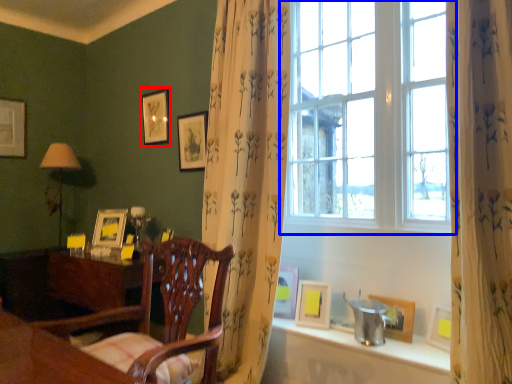
Question: Among these objects, which one is farthest to the camera, picture frame (highlighted by a red box) or window (highlighted by a blue box)?

Choices:
 (A) picture frame
 (B) window

Answer: (A)